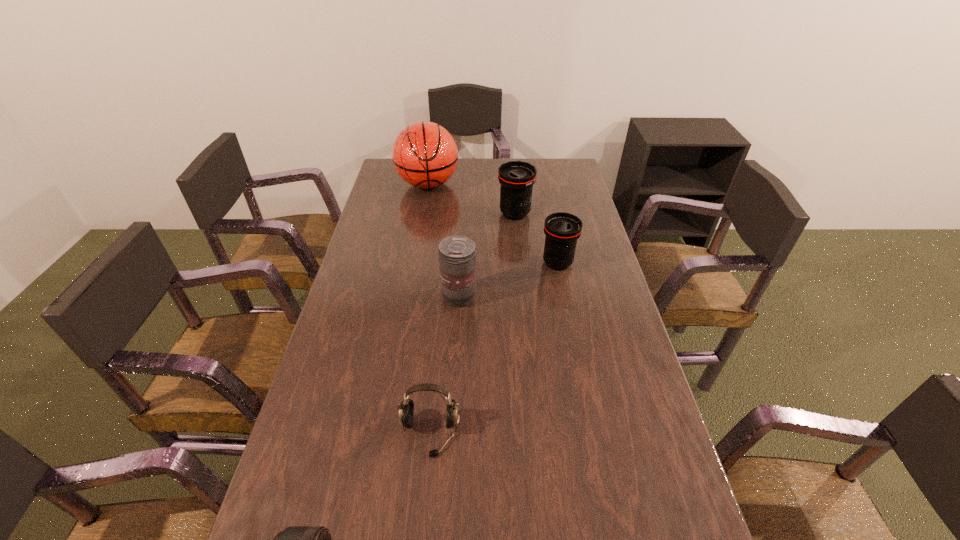
This screenshot has width=960, height=540. In order to click on the second closest telephoto lens relative to the fourth nearest object in this screenshot , I will do pos(456,254).

Where is `vacant space that satisfies the following two spatial constraints: 1. on the side of the third farthest telephoto lens where the control switches are located; 2. with the microphone on the side of the fifth farthest object`? This screenshot has height=540, width=960. vacant space that satisfies the following two spatial constraints: 1. on the side of the third farthest telephoto lens where the control switches are located; 2. with the microphone on the side of the fifth farthest object is located at coordinates (452, 434).